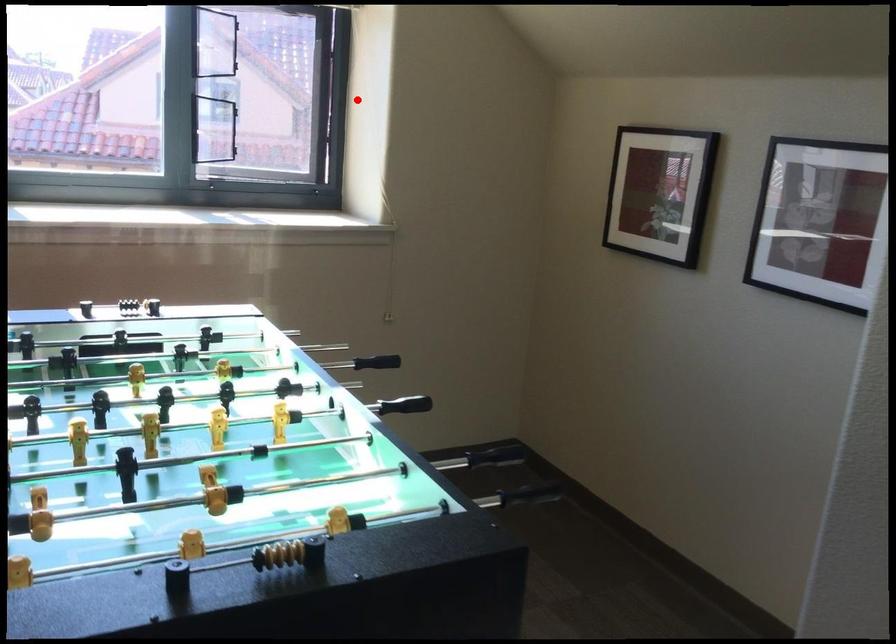
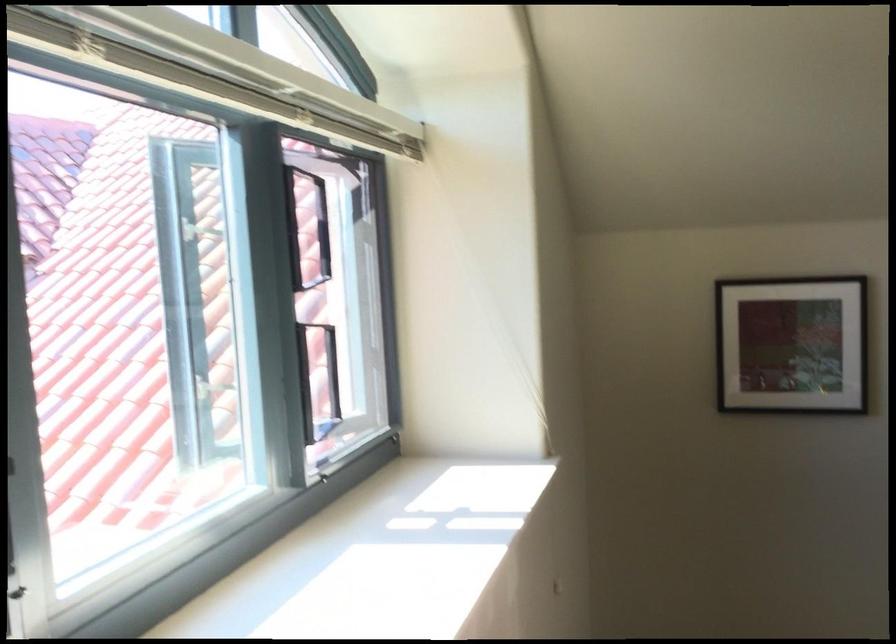
Question: I am providing you with two images of the same scene from different viewpoints. Given a red point in image1, look at the same physical point in image2. Is it:

Choices:
 (A) Closer to the viewpoint
 (B) Farther from the viewpoint

Answer: (A)